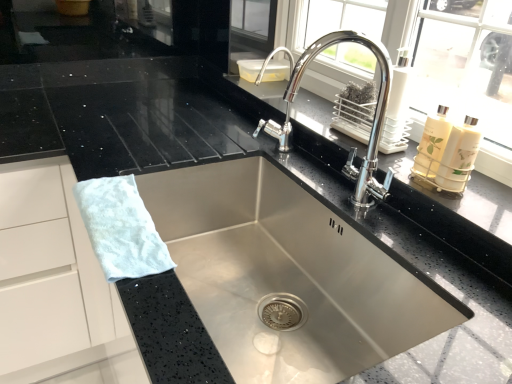
Locate an element on the screen. Image resolution: width=512 pixels, height=384 pixels. empty space that is ontop of white fluffy hand towel at left is located at coordinates click(x=118, y=219).